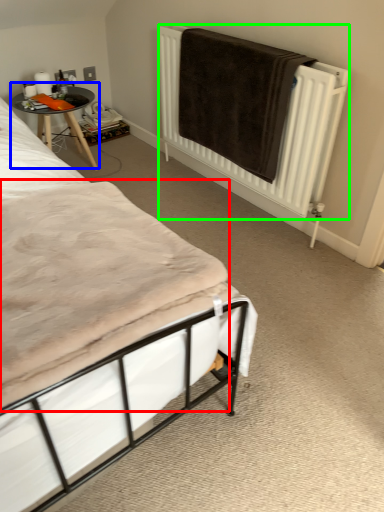
Question: Which is farther away from mattress (highlighted by a red box)? table (highlighted by a blue box) or radiator (highlighted by a green box)?

Choices:
 (A) table
 (B) radiator

Answer: (A)